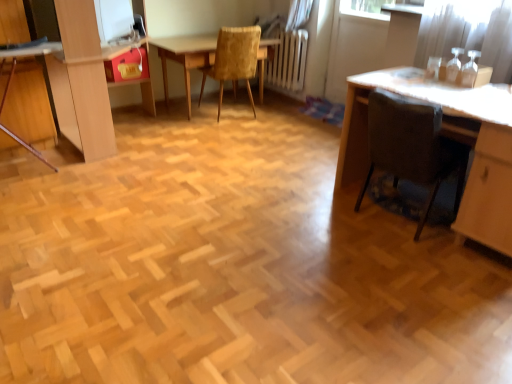
Find the location of a particular element. vacant area that is in front of velvet yellow chair at center, placed as the 1th chair when sorted from top to bottom is located at coordinates (230, 127).